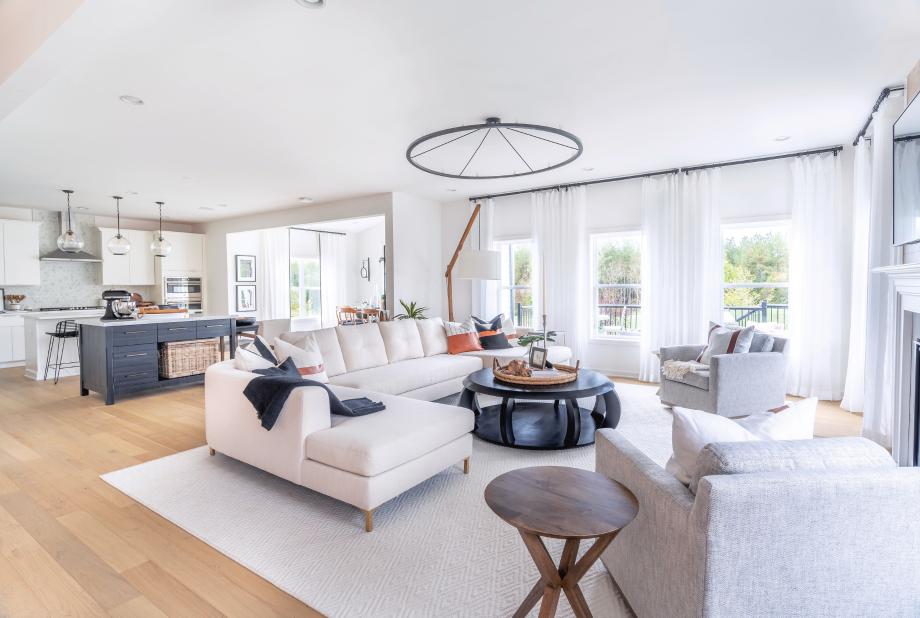
Identify the location of wood floor. (73, 564).